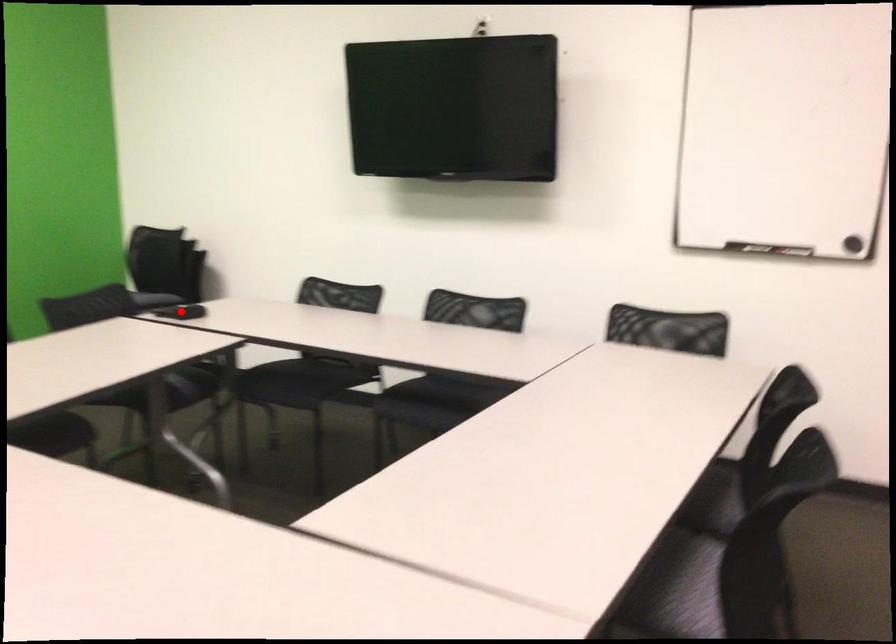
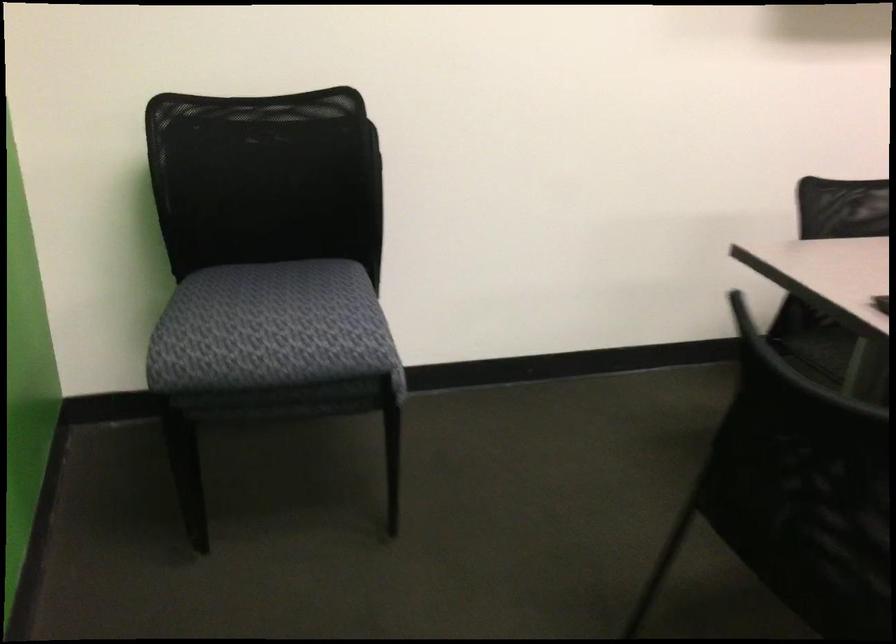
Question: I am providing you with two images of the same scene from different viewpoints. A red point is marked on the first image. At the location where the point appears in image 1, is it still visible in image 2?

Choices:
 (A) Yes
 (B) No

Answer: (B)